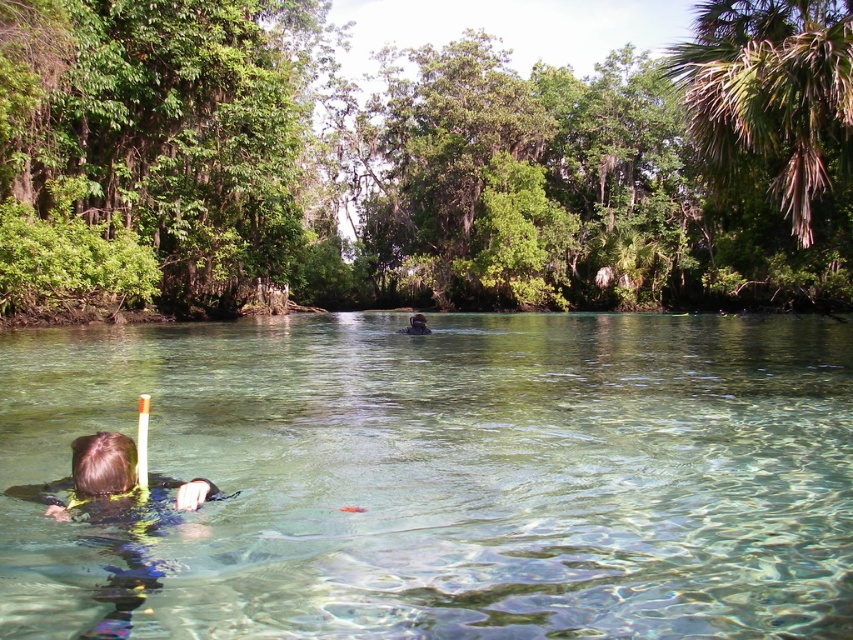
Question: Is clear water at center further to the viewer compared to blue neoprene snorkeler at lower left?

Choices:
 (A) yes
 (B) no

Answer: (A)

Question: Which of the following is the farthest from the observer?

Choices:
 (A) blue neoprene snorkeler at lower left
 (B) yellow-green wetsuit at lower left
 (C) clear water at center

Answer: (B)

Question: Which of the following is the closest to the observer?

Choices:
 (A) yellow-green wetsuit at lower left
 (B) clear water at center

Answer: (B)

Question: Can you confirm if blue neoprene snorkeler at lower left is wider than yellow-green wetsuit at lower left?

Choices:
 (A) no
 (B) yes

Answer: (B)

Question: Does clear water at center appear on the right side of black rubber snorkel at center?

Choices:
 (A) no
 (B) yes

Answer: (B)

Question: Which point is farther to the camera?

Choices:
 (A) (424, 323)
 (B) (131, 458)
 (C) (253, 492)
 (D) (79, 493)

Answer: (A)